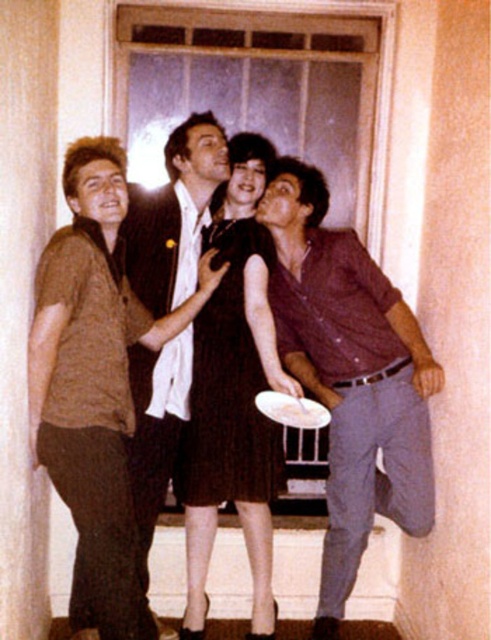
Question: Which point is farther from the camera taking this photo?

Choices:
 (A) (279, 419)
 (B) (183, 483)
 (C) (144, 612)
 (D) (401, 464)

Answer: (B)

Question: Which object is positioned closest to the white glossy platter at center?

Choices:
 (A) matte black dress at center
 (B) purple cotton vest at right

Answer: (B)

Question: Among these objects, which one is nearest to the camera?

Choices:
 (A) purple cotton vest at right
 (B) white glossy platter at center

Answer: (B)

Question: Is matte black dress at center thinner than white glossy platter at center?

Choices:
 (A) yes
 (B) no

Answer: (B)

Question: Does dark brown dress at center have a smaller size compared to white glossy platter at center?

Choices:
 (A) yes
 (B) no

Answer: (B)

Question: Can you confirm if purple cotton vest at right is positioned above white glossy platter at center?

Choices:
 (A) no
 (B) yes

Answer: (B)